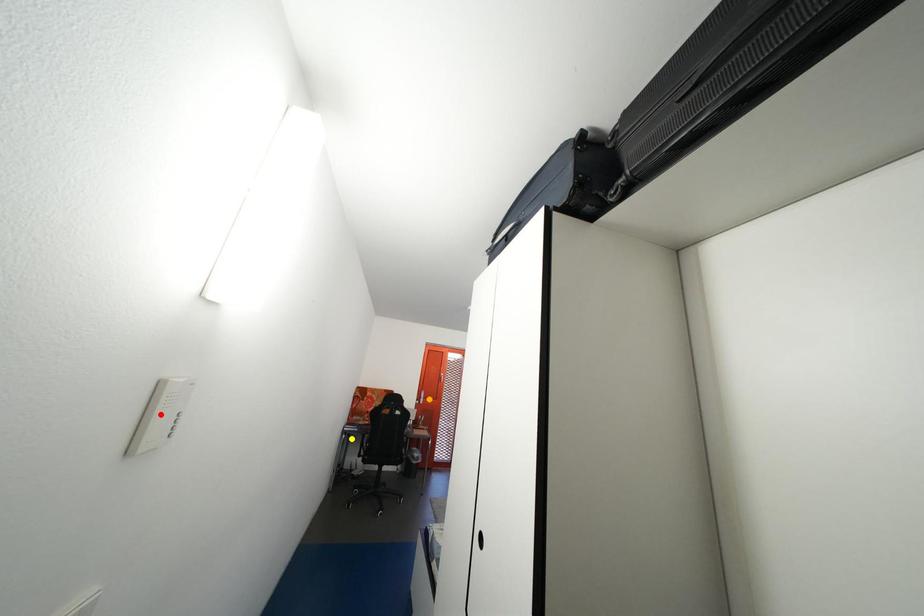
Order these from farthest to nearest:
yellow point
orange point
red point

yellow point
orange point
red point